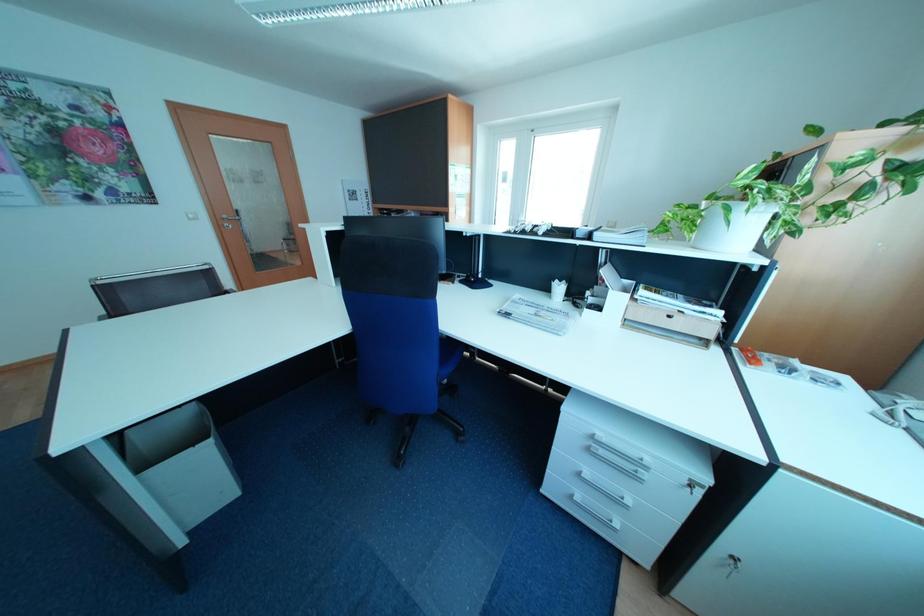
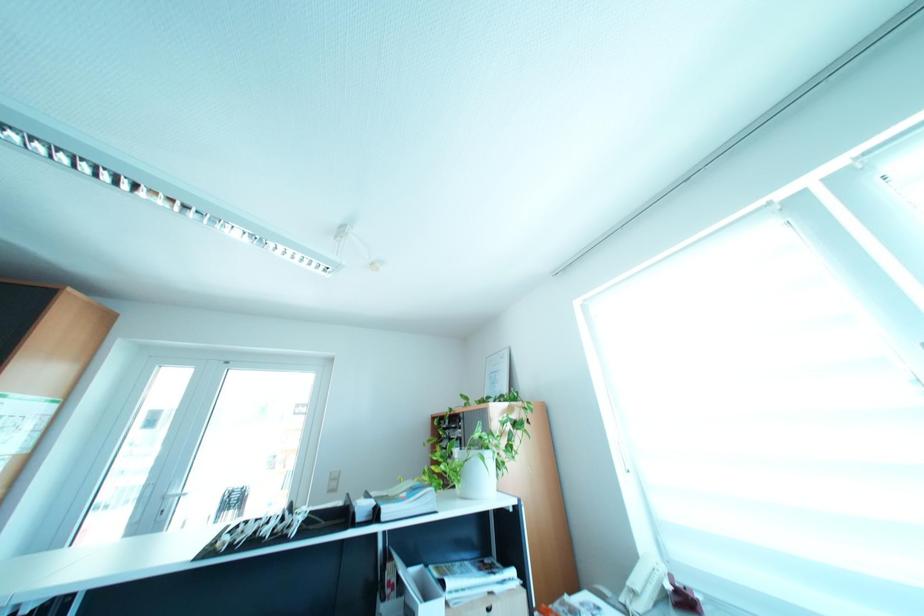
How did the camera likely rotate?

The camera's rotation is toward right-up.